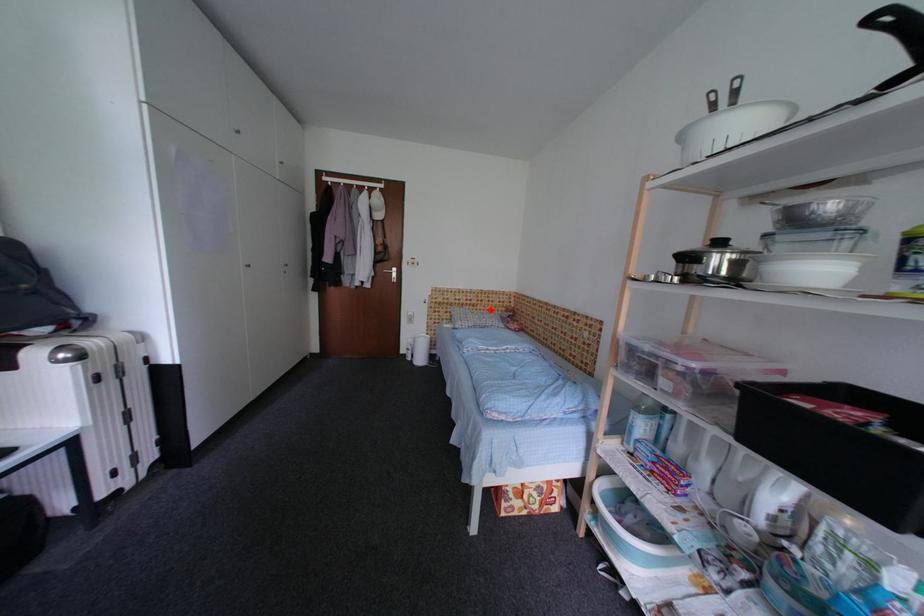
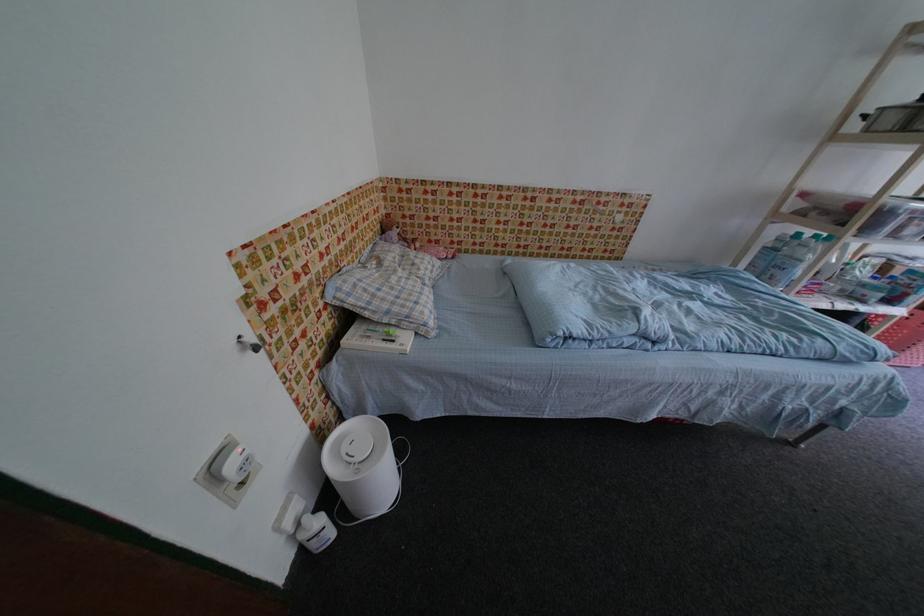
Question: I am providing you with two images of the same scene from different viewpoints. A red point is shown in image1. For the corresponding object point in image2, is it positioned nearer or farther from the camera?

Choices:
 (A) Nearer
 (B) Farther

Answer: (A)